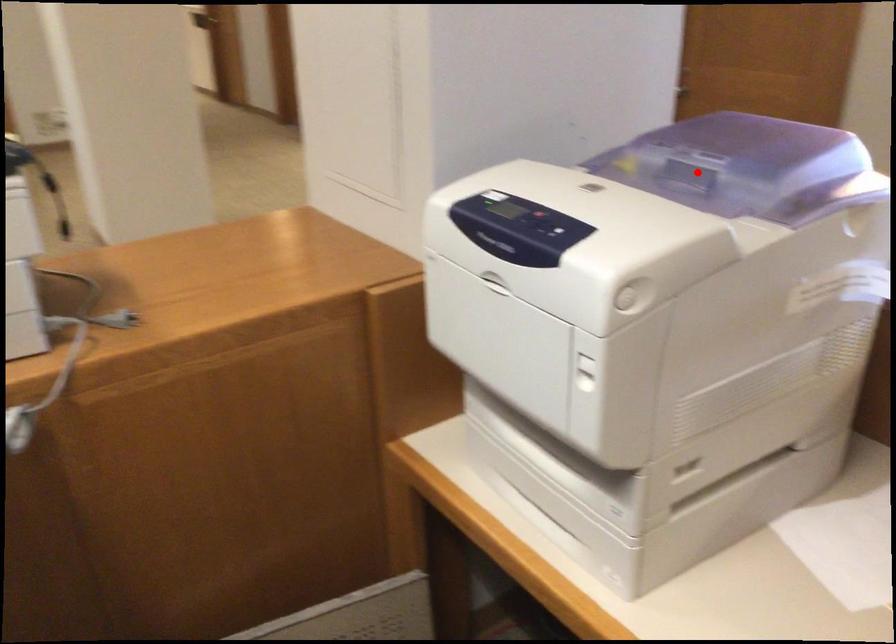
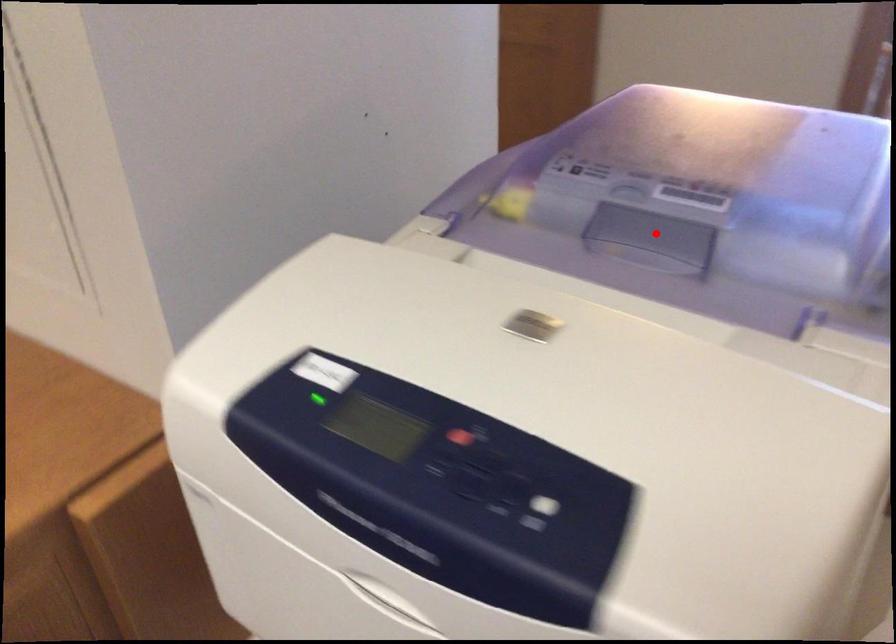
I am providing you with two images of the same scene from different viewpoints. A red point is marked on the first image and another point is marked on the second image. Does the point marked in image1 correspond to the same location as the one in image2?

Yes